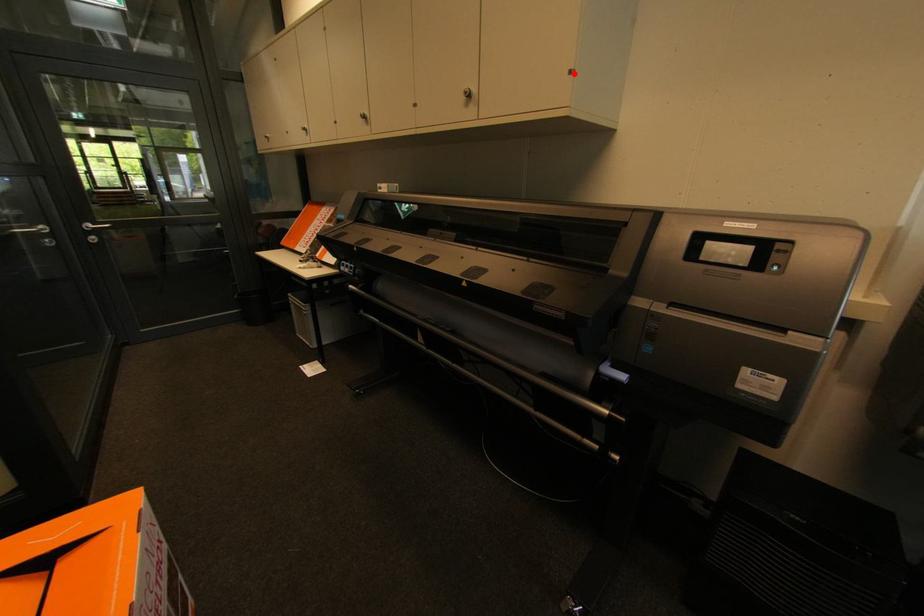
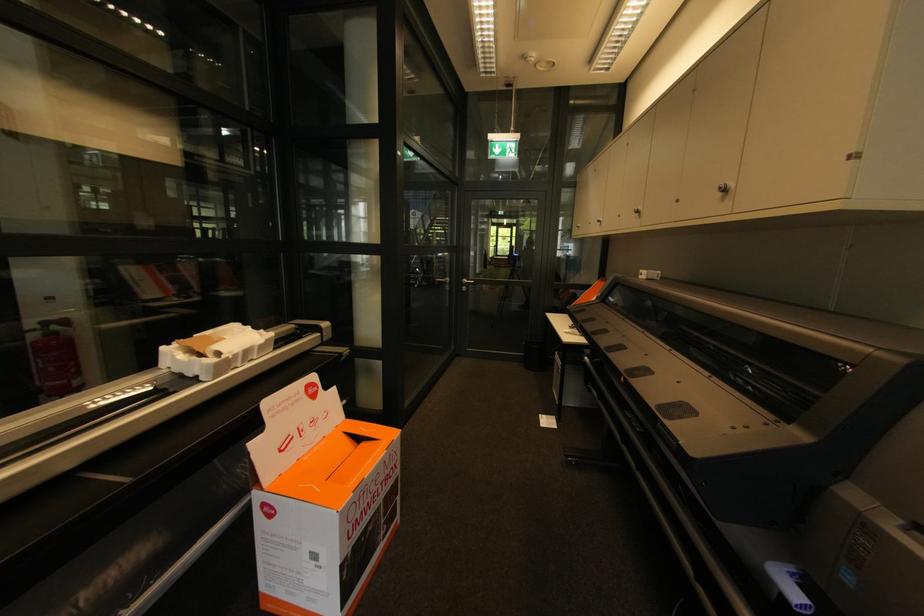
In the second image, find the point that corresponds to the highlighted location in the first image.

(857, 156)